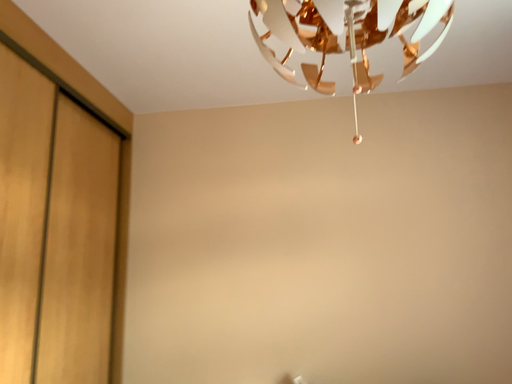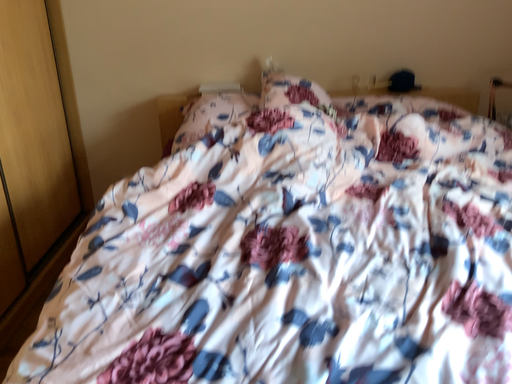
Question: Which way did the camera rotate in the video?

Choices:
 (A) rotated upward
 (B) rotated downward

Answer: (B)